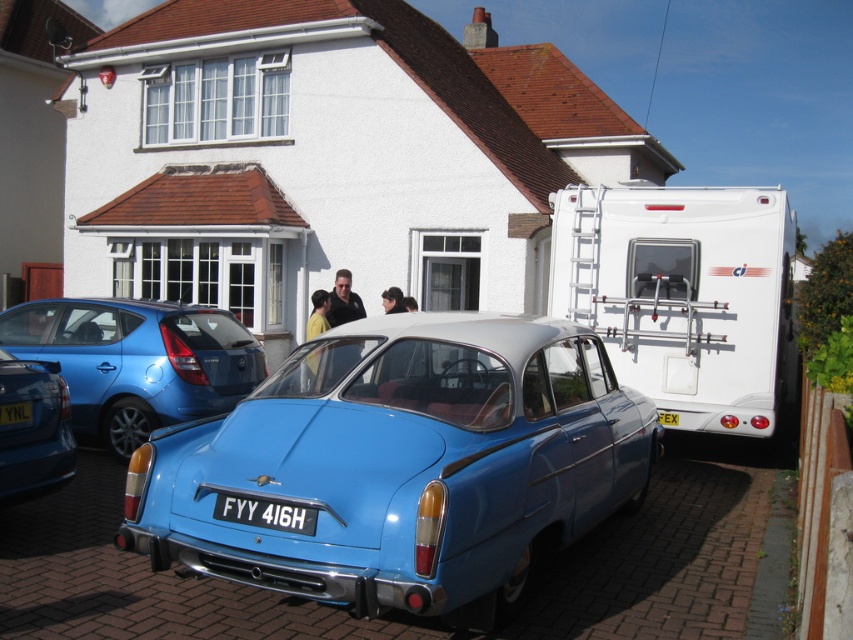
You are a delivery driver who needs to park your vehicle between the blue metallic license plate at center and the yellow matte license plate at lower left. Considering their heights, which license plate should you avoid parking too close to in order to prevent blocking the lower one?

The blue metallic license plate at center is not as tall as the yellow matte license plate at lower left. Therefore, you should avoid parking too close to the yellow matte license plate at lower left to prevent blocking the lower one.

You are a delivery person trying to park a new car in the driveway. The driveway has the matte blue sedan at left and the yellow matte license plate at lower left. Which object should you avoid hitting when pulling into the driveway?

You should avoid hitting the matte blue sedan at left because it is parked closer to where you would enter the driveway, and the yellow matte license plate at lower left is part of the sedan itself, so hitting the sedan would also damage the license plate.

You are a delivery driver who needs to park your vehicle next to the matte blue sedan at left and the matte blue car at left. Which one has more vertical space between its roof and the garage ceiling to fit through a low clearance entrance?

The matte blue car at left is shorter than the matte blue sedan at left, so it has more vertical space between its roof and the garage ceiling to fit through a low clearance entrance.